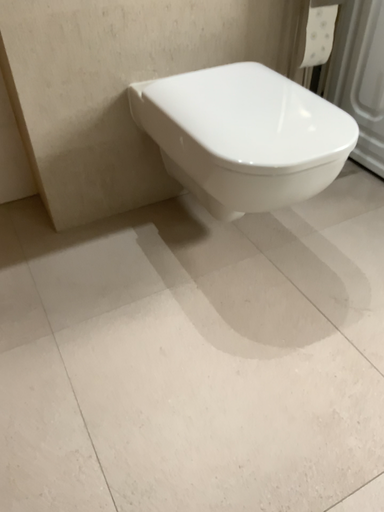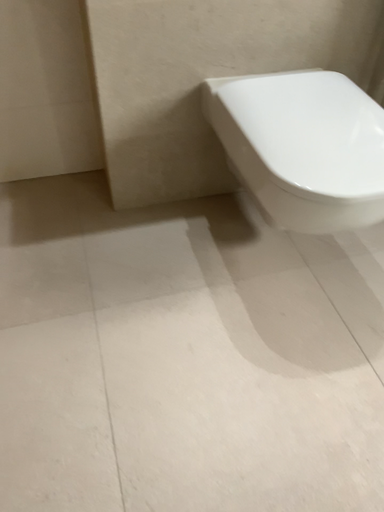
Question: Which way did the camera rotate in the video?

Choices:
 (A) rotated left
 (B) rotated right

Answer: (A)